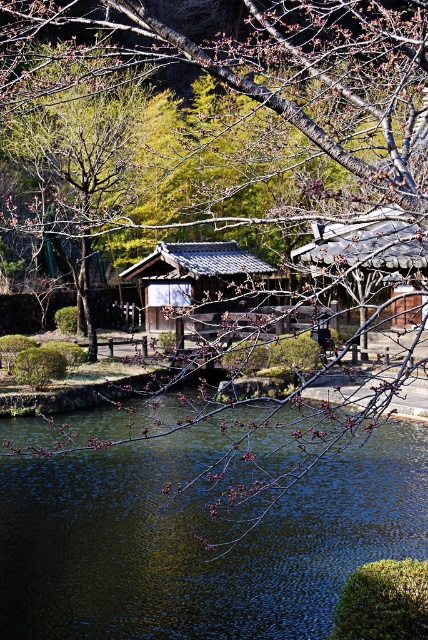
Question: Is shiny dark water at center to the right of matte gray wooden hut at center from the viewer's perspective?

Choices:
 (A) no
 (B) yes

Answer: (B)

Question: Which point is closer to the camera?

Choices:
 (A) matte gray wooden hut at center
 (B) shiny dark water at center

Answer: (A)

Question: Which of the following is the closest to the observer?

Choices:
 (A) matte gray wooden hut at center
 (B) shiny dark water at center

Answer: (A)

Question: Which point is farther to the camera?

Choices:
 (A) shiny dark water at center
 (B) matte gray wooden hut at center

Answer: (A)

Question: In this image, where is shiny dark water at center located relative to matte gray wooden hut at center?

Choices:
 (A) right
 (B) left

Answer: (A)

Question: Does shiny dark water at center have a larger size compared to matte gray wooden hut at center?

Choices:
 (A) yes
 (B) no

Answer: (B)